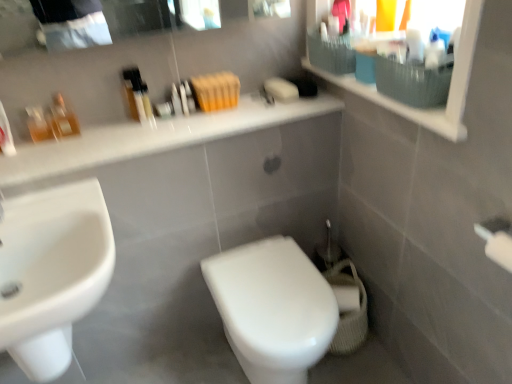
Where is `space that is in front of translucent glass bottles at left, the 3th toiletry from the right`? The height and width of the screenshot is (384, 512). space that is in front of translucent glass bottles at left, the 3th toiletry from the right is located at coordinates (41, 156).